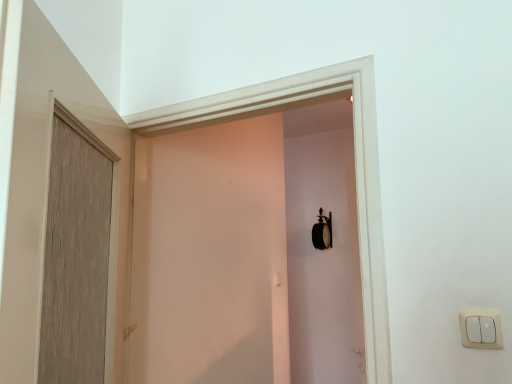
Locate an element on the screen. matte white screen door at center is located at coordinates (210, 256).

Which is in front, point (181, 320) or point (463, 314)?

The point (463, 314) is more forward.

From the image's perspective, is matte white screen door at center below white plastic light switch at lower right?

No.

Visually, is matte white screen door at center positioned to the left or to the right of white plastic light switch at lower right?

In the image, matte white screen door at center appears on the left side of white plastic light switch at lower right.

In the scene shown: Is matte white screen door at center wider or thinner than white plastic light switch at lower right?

Clearly, matte white screen door at center has more width compared to white plastic light switch at lower right.

Which point is more forward, (x=482, y=324) or (x=21, y=333)?

Positioned in front is point (x=21, y=333).

Can you confirm if white plastic light switch at lower right is wider than wooden door at left?

No.

Is white plastic light switch at lower right further to camera compared to wooden door at left?

Yes, white plastic light switch at lower right is further from the viewer.

From a real-world perspective, is white plastic light switch at lower right physically located above or below wooden door at left?

Clearly, from a real-world perspective, white plastic light switch at lower right is below wooden door at left.

You are a GUI agent. You are given a task and a screenshot of the screen. Output one action in this format:
    pyautogui.click(x=<x>, y=<y>)
    Task: Click on the door above the matte white screen door at center (from the image's perspective)
    
    Given the screenshot: What is the action you would take?
    pyautogui.click(x=40, y=168)

Are wooden door at left and matte white screen door at center located far from each other?

That's not correct — wooden door at left is a little close to matte white screen door at center.

From a real-world perspective, is wooden door at left positioned over matte white screen door at center based on gravity?

No, from a real-world perspective, wooden door at left is not above matte white screen door at center.

From the image's perspective, which one is positioned higher, white plastic light switch at lower right or matte white screen door at center?

matte white screen door at center appears higher in the image.

Which point is more forward, (477, 313) or (241, 311)?

The point (477, 313) is closer to the camera.

From the picture: What's the angular difference between white plastic light switch at lower right and matte white screen door at center's facing directions?

white plastic light switch at lower right and matte white screen door at center are facing 0.187 degrees away from each other.

Between white plastic light switch at lower right and matte white screen door at center, which one appears on the right side from the viewer's perspective?

Positioned to the right is white plastic light switch at lower right.

Between matte white screen door at center and wooden door at left, which one has less height?

Standing shorter between the two is wooden door at left.

Could you tell me if matte white screen door at center is facing wooden door at left?

Yes, matte white screen door at center is oriented towards wooden door at left.

Is matte white screen door at center outside of wooden door at left?

matte white screen door at center is positioned outside wooden door at left.

Is wooden door at left positioned with its back to white plastic light switch at lower right?

No, wooden door at left's orientation is not away from white plastic light switch at lower right.

Is the position of wooden door at left more distant than that of white plastic light switch at lower right?

No, it is not.

Looking at this image, considering the relative positions of wooden door at left and white plastic light switch at lower right in the image provided, is wooden door at left to the left of white plastic light switch at lower right from the viewer's perspective?

Correct, you'll find wooden door at left to the left of white plastic light switch at lower right.

Where is `light switch below the matte white screen door at center (from a real-world perspective)`? This screenshot has width=512, height=384. light switch below the matte white screen door at center (from a real-world perspective) is located at coordinates (481, 329).

At what (x,y) coordinates should I click in order to perform the action: click on door in front of the white plastic light switch at lower right. Please return your answer as a coordinate pair (x, y). The height and width of the screenshot is (384, 512). Looking at the image, I should click on (40, 168).

Which object lies further to the anchor point white plastic light switch at lower right, matte white screen door at center or wooden door at left?

The object further to white plastic light switch at lower right is matte white screen door at center.

Based on their spatial positions, is white plastic light switch at lower right or matte white screen door at center closer to wooden door at left?

matte white screen door at center is closer to wooden door at left.

When comparing their distances from matte white screen door at center, does wooden door at left or white plastic light switch at lower right seem closer?

wooden door at left.

From the image, which object appears to be farther from white plastic light switch at lower right, wooden door at left or matte white screen door at center?

matte white screen door at center is further to white plastic light switch at lower right.

Based on their spatial positions, is matte white screen door at center or white plastic light switch at lower right further from wooden door at left?

Based on the image, white plastic light switch at lower right appears to be further to wooden door at left.

Based on their spatial positions, is white plastic light switch at lower right or wooden door at left closer to matte white screen door at center?

Based on the image, wooden door at left appears to be nearer to matte white screen door at center.

Find the location of a particular element. This screenshot has width=512, height=384. screen door between wooden door at left and white plastic light switch at lower right in the horizontal direction is located at coordinates (210, 256).